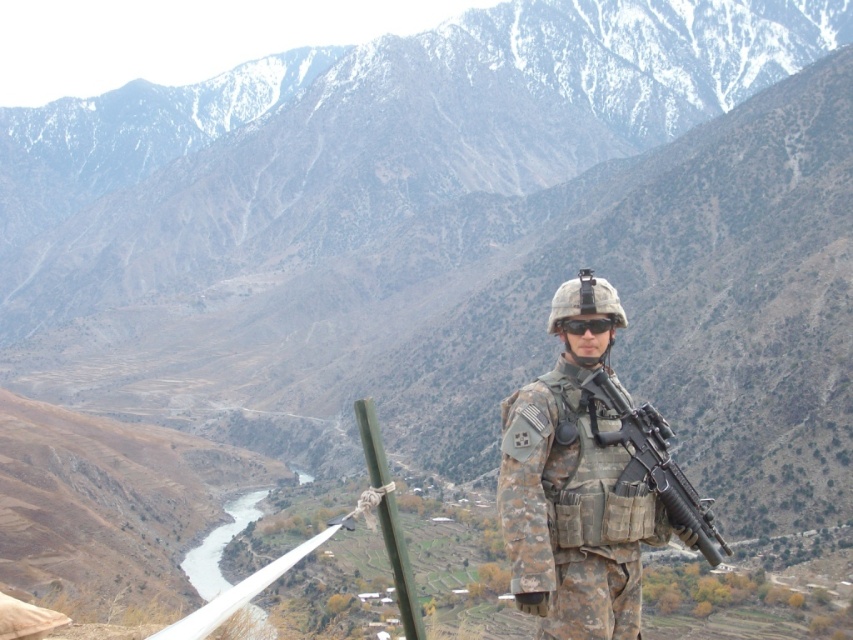
Question: Is camouflage uniform at center smaller than black matte goggles at center?

Choices:
 (A) no
 (B) yes

Answer: (A)

Question: Among these objects, which one is nearest to the camera?

Choices:
 (A) camouflage uniform at center
 (B) matte black rifle at center
 (C) black matte goggles at center

Answer: (A)

Question: Which point is closer to the camera taking this photo?

Choices:
 (A) (596, 323)
 (B) (682, 506)

Answer: (B)

Question: Does camouflage uniform at center come in front of black matte goggles at center?

Choices:
 (A) yes
 (B) no

Answer: (A)

Question: Can you confirm if camouflage uniform at center is wider than black matte goggles at center?

Choices:
 (A) no
 (B) yes

Answer: (B)

Question: Among these objects, which one is farthest from the camera?

Choices:
 (A) black matte goggles at center
 (B) matte black rifle at center

Answer: (A)